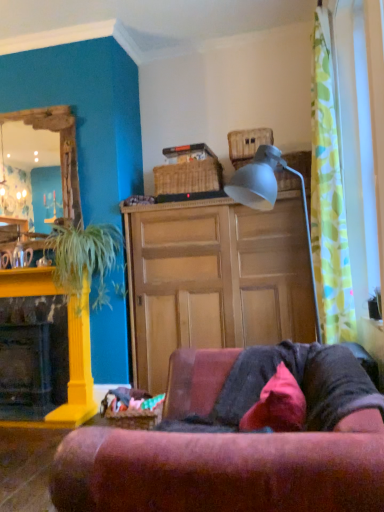
Question: Does wooden cabinet at center touch green leafy plant at left?

Choices:
 (A) no
 (B) yes

Answer: (A)

Question: Is wooden cabinet at center wider than green leafy plant at left?

Choices:
 (A) no
 (B) yes

Answer: (B)

Question: From the image's perspective, would you say wooden cabinet at center is positioned over green leafy plant at left?

Choices:
 (A) no
 (B) yes

Answer: (A)

Question: Is wooden cabinet at center at the left side of green leafy plant at left?

Choices:
 (A) yes
 (B) no

Answer: (B)

Question: Is wooden cabinet at center facing towards green leafy plant at left?

Choices:
 (A) yes
 (B) no

Answer: (B)

Question: Is wooden cabinet at center to the right of green leafy plant at left from the viewer's perspective?

Choices:
 (A) yes
 (B) no

Answer: (A)

Question: Is wooden mirror at left taller than woven brown picnic basket at upper center, which ranks as the first picnic basket in right-to-left order?

Choices:
 (A) yes
 (B) no

Answer: (A)

Question: Is wooden mirror at left positioned in front of woven brown picnic basket at upper center, marked as the 3th picnic basket in a left-to-right arrangement?

Choices:
 (A) yes
 (B) no

Answer: (B)

Question: Does wooden mirror at left come behind woven brown picnic basket at upper center, the first picnic basket positioned from the top?

Choices:
 (A) yes
 (B) no

Answer: (A)

Question: Is there a large distance between wooden mirror at left and woven brown picnic basket at upper center, the first picnic basket positioned from the top?

Choices:
 (A) yes
 (B) no

Answer: (A)

Question: Is wooden mirror at left positioned with its back to woven brown picnic basket at upper center, the first picnic basket positioned from the top?

Choices:
 (A) yes
 (B) no

Answer: (B)

Question: Is wooden mirror at left bigger than woven brown picnic basket at upper center, which ranks as the first picnic basket in right-to-left order?

Choices:
 (A) no
 (B) yes

Answer: (B)

Question: Is wooden cabinet at center far away from green floral fabric curtain at right?

Choices:
 (A) yes
 (B) no

Answer: (B)